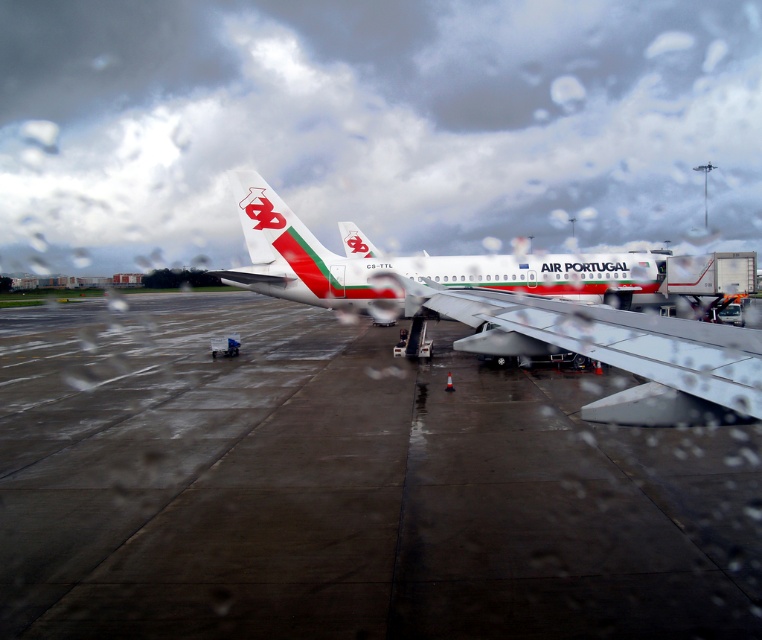
Who is higher up, concrete at center or white glossy airplane at center?

white glossy airplane at center

Locate an element on the screen. The height and width of the screenshot is (640, 762). concrete at center is located at coordinates (346, 486).

Who is more distant from viewer, (248, 433) or (460, 264)?

Point (460, 264)

The height and width of the screenshot is (640, 762). What are the coordinates of `concrete at center` in the screenshot? It's located at (346, 486).